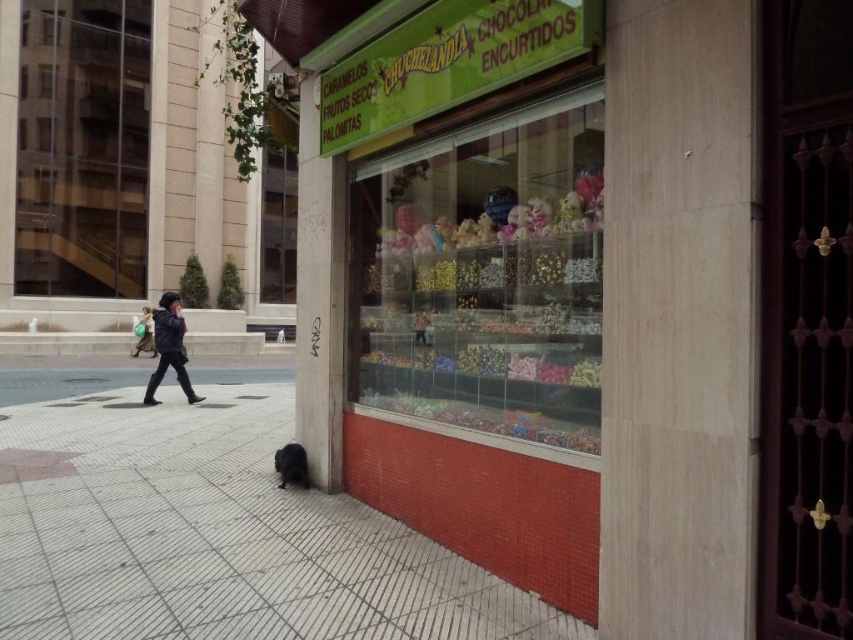
You are a delivery person carrying a box that is 2 meters wide. You need to walk from the street to the store entrance. The path goes between the black tile pavement at lower left and the clear glass display case at center. Can your box fit through the path?

The black tile pavement at lower left is wider than the clear glass display case at center. However, the path between them is not specified in the Objects Description. Therefore, it is impossible to determine if the box will fit through the path.

You are a delivery person who needs to place a package on the storefront window. The delivery instructions specify that the package must be placed exactly at the coordinates of the black matte jacket at left. Where should you place the package?

The package should be placed at the coordinates point (169, 348) where the black matte jacket at left is located.